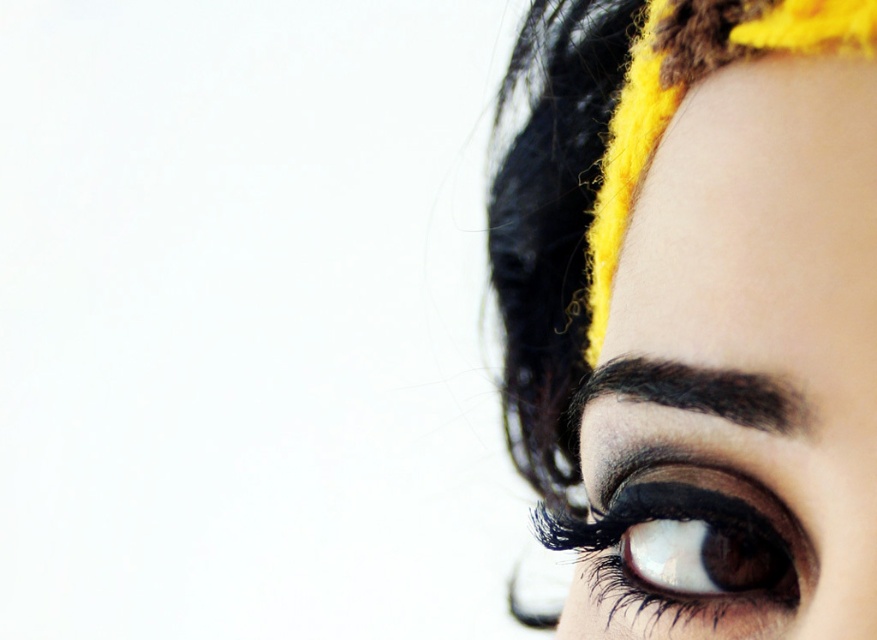
Can you confirm if matte black eye at upper right is taller than shiny brown eye at center?

Yes, matte black eye at upper right is taller than shiny brown eye at center.

Which is behind, point (824, 408) or point (605, 486)?

Point (605, 486)

Identify the location of matte black eye at upper right. This screenshot has height=640, width=877. (697, 312).

Which is below, matte black eye at upper right or dark brown hair at upper right?

Positioned lower is dark brown hair at upper right.

Does matte black eye at upper right have a greater height compared to dark brown hair at upper right?

Indeed, matte black eye at upper right has a greater height compared to dark brown hair at upper right.

Between point (853, 156) and point (726, 412), which one is positioned behind?

The point (726, 412) is more distant.

Locate an element on the screen. matte black eye at upper right is located at coordinates (697, 312).

Is shiny brown eye at center positioned before dark brown hair at upper right?

No.

Between shiny brown eye at center and dark brown hair at upper right, which one has less height?

dark brown hair at upper right

Which is behind, point (789, 561) or point (772, 422)?

Positioned behind is point (789, 561).

The image size is (877, 640). Identify the location of shiny brown eye at center. (683, 552).